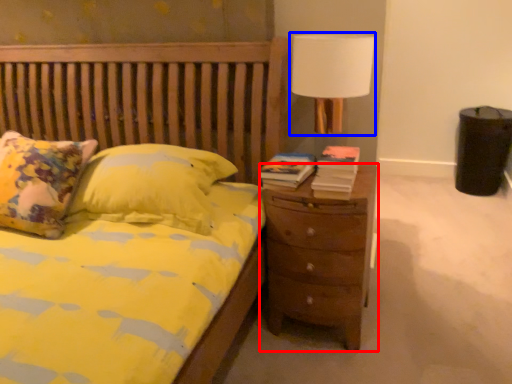
Question: Which object appears closest to the camera in this image, nightstand (highlighted by a red box) or lamp (highlighted by a blue box)?

Choices:
 (A) nightstand
 (B) lamp

Answer: (B)